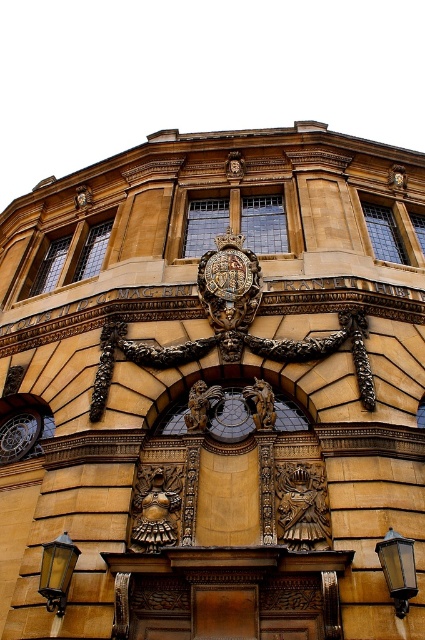
Question: Which object is positioned farthest from the matte gold lamp at lower left?

Choices:
 (A) metallic glass lamp at lower right
 (B) gold textured clock at center
 (C) gold metallic clock at center

Answer: (C)

Question: Does matte gold lamp at lower left have a larger size compared to gold metallic clock at center?

Choices:
 (A) yes
 (B) no

Answer: (A)

Question: Which object is the farthest from the matte gold lamp at lower left?

Choices:
 (A) metallic glass lamp at lower right
 (B) gold metallic clock at center

Answer: (B)

Question: Can you confirm if matte gold lamp at lower left is wider than gold textured clock at center?

Choices:
 (A) no
 (B) yes

Answer: (B)

Question: Which point is farther from the camera taking this photo?

Choices:
 (A) (401, 180)
 (B) (407, 600)
 (C) (70, 576)

Answer: (A)

Question: Is matte gold lamp at lower left smaller than gold metallic clock at center?

Choices:
 (A) yes
 (B) no

Answer: (B)